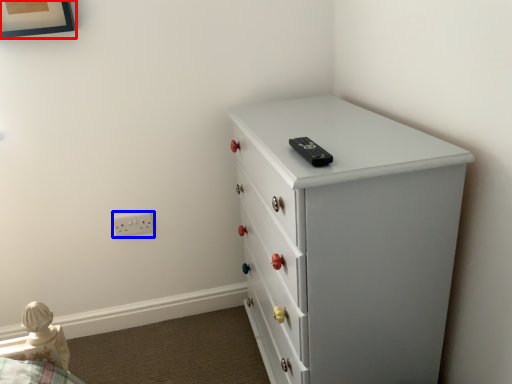
Question: Which point is further to the camera, picture frame (highlighted by a red box) or electric outlet (highlighted by a blue box)?

Choices:
 (A) picture frame
 (B) electric outlet

Answer: (B)